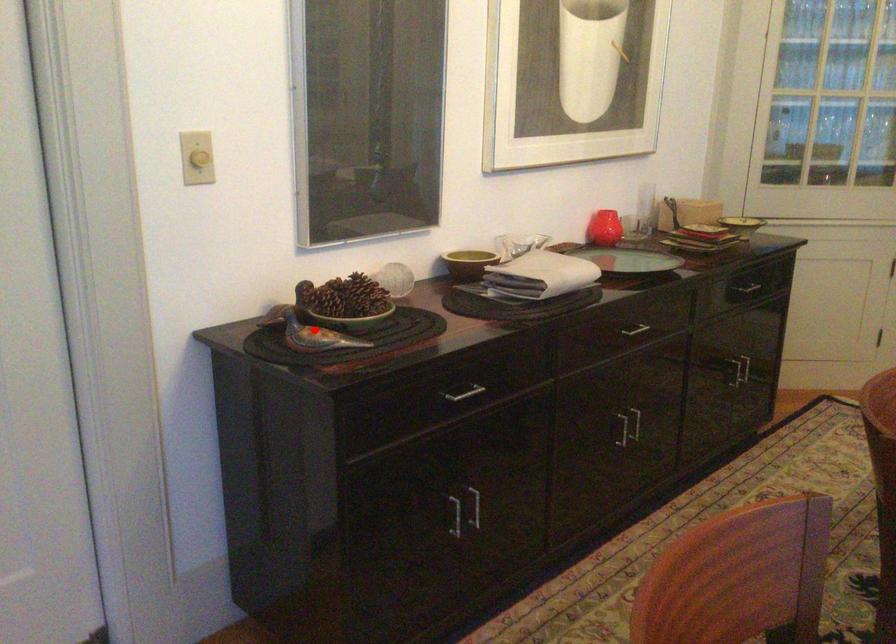
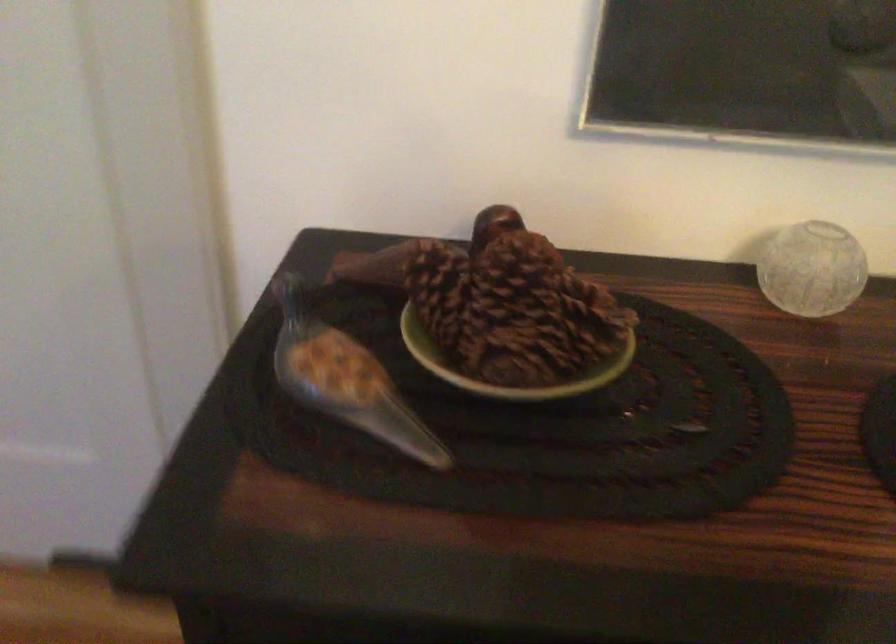
Question: I am providing you with two images of the same scene from different viewpoints. Image1 has a red point marked. In image2, the corresponding 3D location appears at what relative position? Reply with the corresponding letter.

Choices:
 (A) Closer
 (B) Farther

Answer: (A)